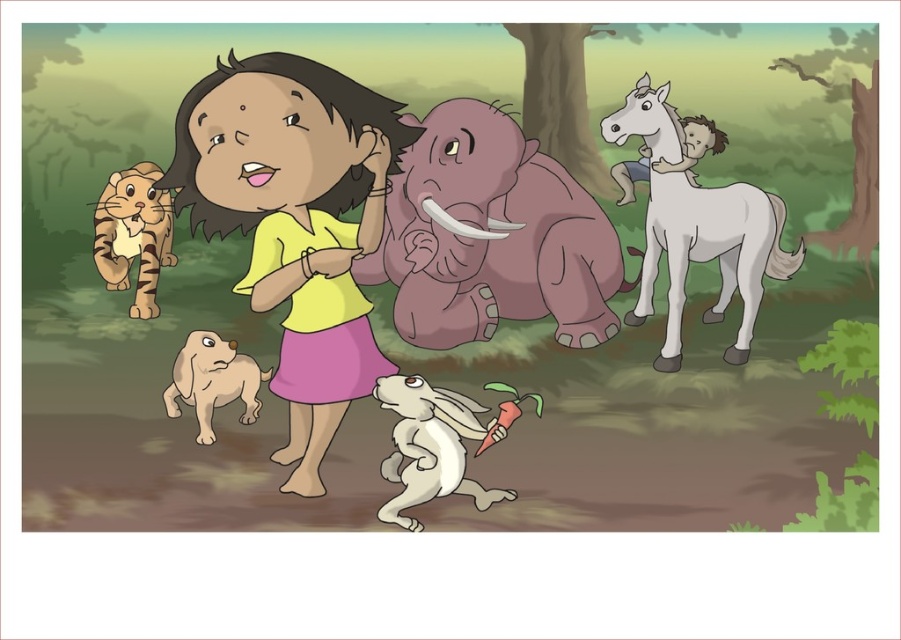
Which of these two, white glossy horse at upper right or white matte rabbit at lower center, stands taller?

With more height is white glossy horse at upper right.

Does point (734, 355) come in front of point (392, 429)?

No, it is not.

The height and width of the screenshot is (640, 901). Find the location of `white glossy horse at upper right`. white glossy horse at upper right is located at coordinates (697, 221).

Does point (508, 403) come farther from viewer compared to point (194, 339)?

No, it is in front of (194, 339).

Is white matte rabbit at lower center to the left of fuzzy beige dog at lower left from the viewer's perspective?

Incorrect, white matte rabbit at lower center is not on the left side of fuzzy beige dog at lower left.

Is point (458, 413) positioned after point (255, 388)?

That is False.

Image resolution: width=901 pixels, height=640 pixels. What are the coordinates of `white matte rabbit at lower center` in the screenshot? It's located at (434, 444).

Between point (288, 452) and point (658, 113), which one is positioned in front?

Point (288, 452)

Who is more distant from viewer, [324,353] or [670,326]?

Positioned behind is point [670,326].

Identify the location of yellow matte shirt at center. This screenshot has width=901, height=640. (296, 221).